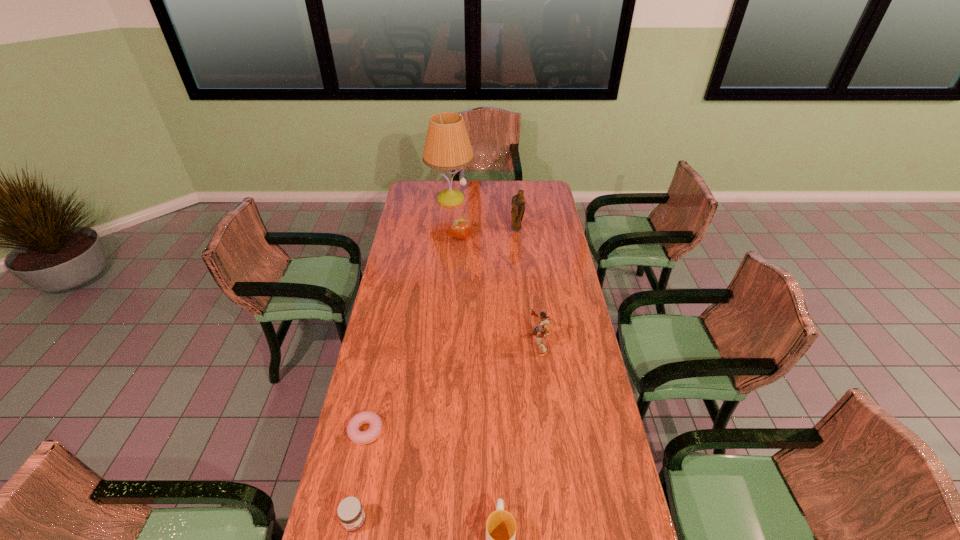
This screenshot has height=540, width=960. I want to click on empty space between the apple and the puncher, so click(x=499, y=291).

In order to click on free space between the figurine and the jam in this screenshot , I will do `click(436, 376)`.

Locate an element on the screen. unoccupied area between the apple and the figurine is located at coordinates (489, 234).

In order to click on vacant region between the doughnut and the jam in this screenshot , I will do (x=360, y=476).

Locate an element on the screen. object that stands as the sixth closest to the tallest object is located at coordinates (351, 514).

The image size is (960, 540). I want to click on object that stands as the third closest to the sixth shortest object, so point(542,330).

Where is `vacant region that satisfies the following two spatial constraints: 1. on the front-facing side of the fourth farthest object; 2. on the front label of the jam`? The height and width of the screenshot is (540, 960). vacant region that satisfies the following two spatial constraints: 1. on the front-facing side of the fourth farthest object; 2. on the front label of the jam is located at coordinates (561, 522).